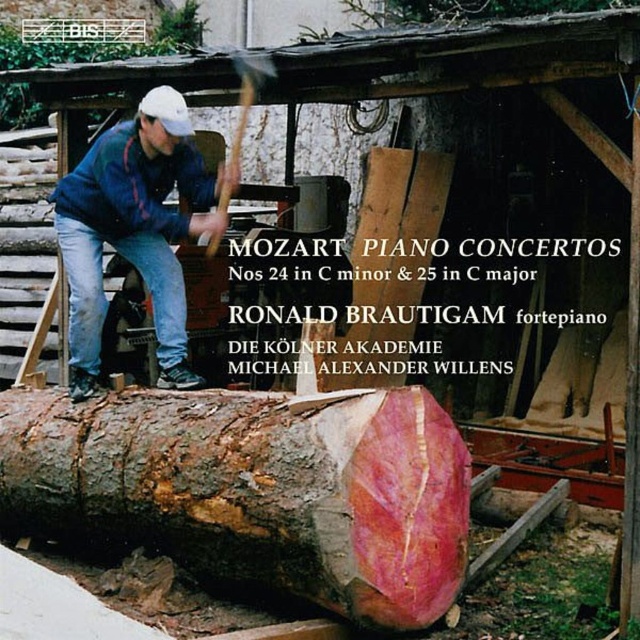
Which of these two, smooth reddish-brown log at lower center or blue denim jeans at left, stands shorter?

Standing shorter between the two is smooth reddish-brown log at lower center.

Describe the element at coordinates (253, 490) in the screenshot. I see `smooth reddish-brown log at lower center` at that location.

Locate an element on the screen. The width and height of the screenshot is (640, 640). smooth reddish-brown log at lower center is located at coordinates (253, 490).